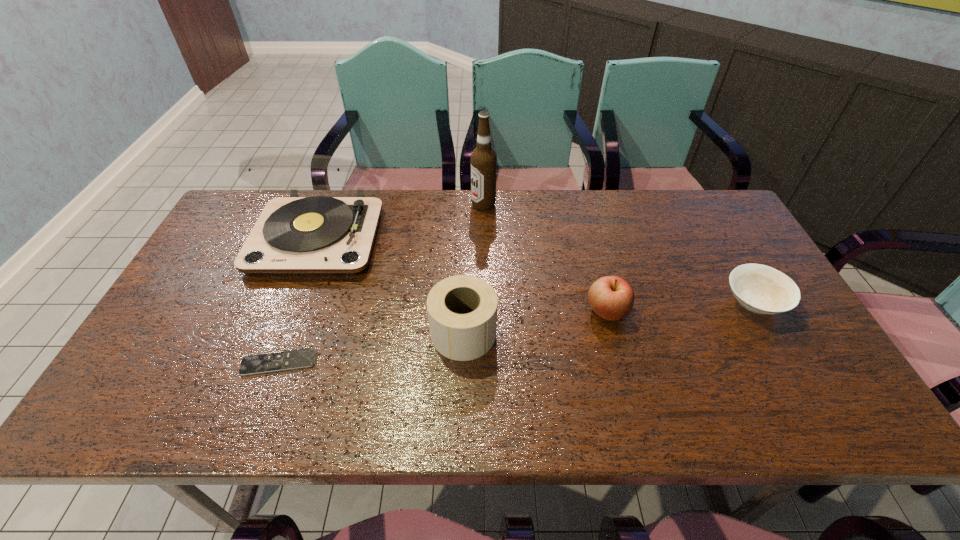
In the image, there is a desktop. At what (x,y) coordinates should I click in order to perform the action: click on vacant space at the far edge. Please return your answer as a coordinate pair (x, y). The image size is (960, 540). Looking at the image, I should click on (549, 202).

This screenshot has width=960, height=540. What are the coordinates of `free region at the near edge of the desktop` in the screenshot? It's located at (334, 403).

Image resolution: width=960 pixels, height=540 pixels. Find the location of `free space at the left edge`. free space at the left edge is located at coordinates (227, 241).

Identify the location of free space at the right edge of the desktop. (710, 252).

The image size is (960, 540). Identify the location of free spot between the toilet tissue and the alcohol. (473, 269).

Where is `unoccupied area between the toilet tissue and the record player`? This screenshot has width=960, height=540. unoccupied area between the toilet tissue and the record player is located at coordinates (391, 285).

Locate an element on the screen. The height and width of the screenshot is (540, 960). unoccupied position between the second object from right to left and the toilet tissue is located at coordinates (536, 322).

Find the location of a particular element. This screenshot has width=960, height=540. free point between the apple and the second shortest object is located at coordinates (681, 307).

What are the coordinates of `free spot between the shortest object and the toilet tissue` in the screenshot? It's located at (372, 348).

The width and height of the screenshot is (960, 540). I want to click on unoccupied area between the rightmost object and the apple, so click(681, 307).